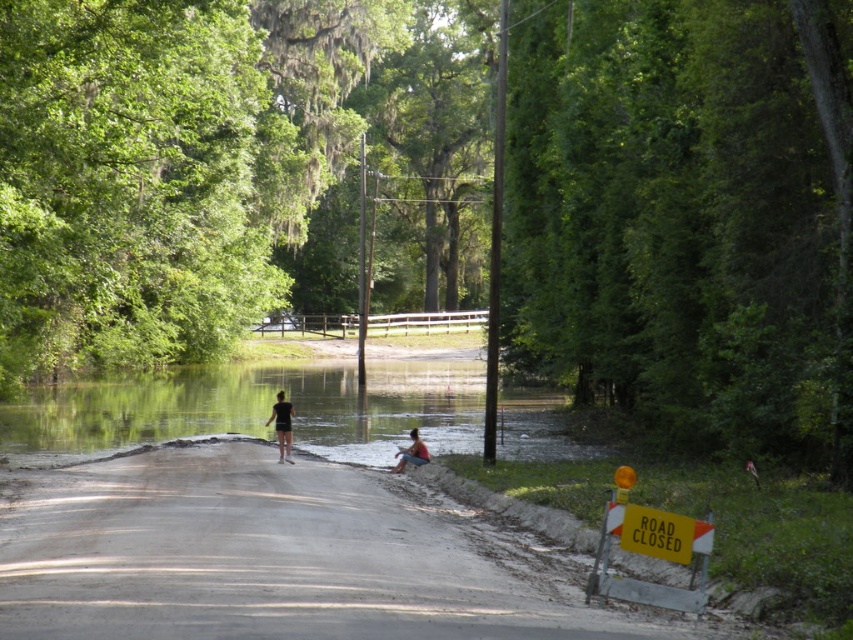
You are a hiker wearing either the black matte shorts at center or the blue denim shorts at center. The flooded road has water reaching the bottom of the asphalt. Which pair of shorts should you choose to cross the flooded road safely?

The black matte shorts at center has a greater height compared to blue denim shorts at center, so you should choose the black matte shorts at center to have better coverage against the water.

You are a hiker with a pair of black matte shorts at center and you see clear water at center in front of you. Do you need to adjust your position to avoid getting your shorts wet?

The black matte shorts at center is behind clear water at center, so the shorts are already behind the water. Therefore, you don not need to adjust your position to avoid getting your shorts wet.

You are a pedestrian trying to cross the flooded road. You see two pairs of shorts at the center of the road. Which pair is closer to you, the black matte shorts at center or the blue denim shorts at center?

The black matte shorts at center is in front of the blue denim shorts at center, so the black matte shorts at center is closer to you.